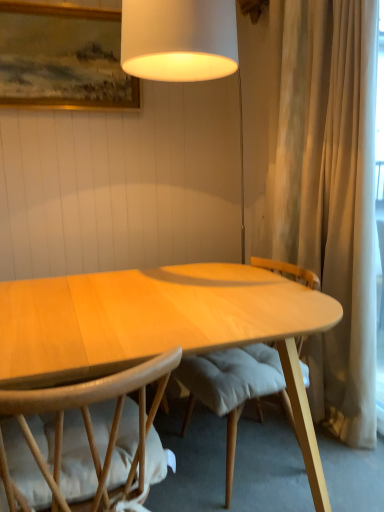
Question: Is wooden framed painting at upper left facing towards light brown wood chair at lower left?

Choices:
 (A) no
 (B) yes

Answer: (A)

Question: Considering the relative sizes of wooden framed painting at upper left and light brown wood chair at lower left in the image provided, is wooden framed painting at upper left smaller than light brown wood chair at lower left?

Choices:
 (A) yes
 (B) no

Answer: (A)

Question: From the image's perspective, is wooden framed painting at upper left below light brown wood chair at lower left?

Choices:
 (A) yes
 (B) no

Answer: (B)

Question: Could light brown wood chair at lower left be considered to be inside wooden framed painting at upper left?

Choices:
 (A) yes
 (B) no

Answer: (B)

Question: Can you confirm if wooden framed painting at upper left is positioned to the right of light brown wood chair at lower left?

Choices:
 (A) yes
 (B) no

Answer: (B)

Question: In the image, is light brown wood chair at lower left on the left side or the right side of wooden framed painting at upper left?

Choices:
 (A) left
 (B) right

Answer: (B)

Question: Would you say light brown wood chair at lower left is inside or outside wooden framed painting at upper left?

Choices:
 (A) outside
 (B) inside

Answer: (A)

Question: Considering the positions of point (59, 442) and point (39, 19), is point (59, 442) closer or farther from the camera than point (39, 19)?

Choices:
 (A) farther
 (B) closer

Answer: (B)

Question: From the image's perspective, is light brown wood chair at lower left above or below wooden framed painting at upper left?

Choices:
 (A) below
 (B) above

Answer: (A)

Question: Would you say light wood desk at center is to the left or to the right of light brown wood chair at lower left in the picture?

Choices:
 (A) left
 (B) right

Answer: (B)

Question: Is point (0, 352) positioned closer to the camera than point (132, 430)?

Choices:
 (A) closer
 (B) farther

Answer: (A)

Question: From the image's perspective, is light wood desk at center positioned above or below light brown wood chair at lower left?

Choices:
 (A) below
 (B) above

Answer: (B)

Question: From a real-world perspective, is light wood desk at center physically located above or below light brown wood chair at lower left?

Choices:
 (A) above
 (B) below

Answer: (A)

Question: In terms of width, does light brown wood chair at lower left look wider or thinner when compared to light wood desk at center?

Choices:
 (A) thin
 (B) wide

Answer: (B)

Question: From a real-world perspective, is light brown wood chair at lower left physically located above or below light wood desk at center?

Choices:
 (A) below
 (B) above

Answer: (A)